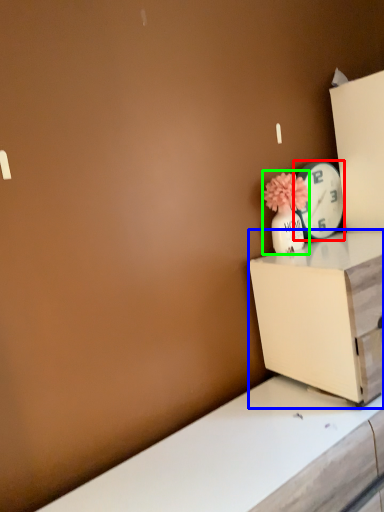
Question: Considering the real-world distances, which object is closest to clock (highlighted by a red box)? nightstand (highlighted by a blue box) or floral arrangement (highlighted by a green box).

Choices:
 (A) nightstand
 (B) floral arrangement

Answer: (B)